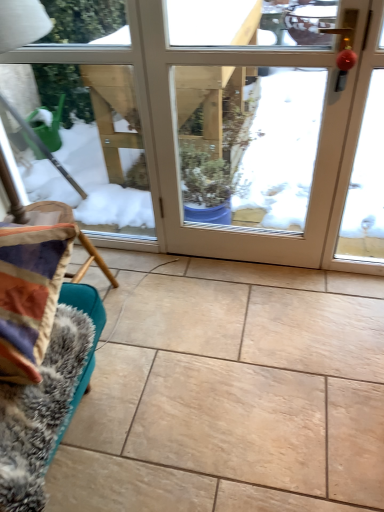
Question: Based on their sizes in the image, would you say beige ceramic tile at center is bigger or smaller than white glossy door at center?

Choices:
 (A) big
 (B) small

Answer: (A)

Question: From their relative heights in the image, would you say beige ceramic tile at center is taller or shorter than white glossy door at center?

Choices:
 (A) tall
 (B) short

Answer: (B)

Question: Which object is positioned closest to the beige ceramic tile at center?

Choices:
 (A) fuzzy fabric couch at lower left
 (B) white glossy door at center

Answer: (A)

Question: Which of these objects is positioned farthest from the white glossy door at center?

Choices:
 (A) beige ceramic tile at center
 (B) fuzzy fabric couch at lower left

Answer: (B)